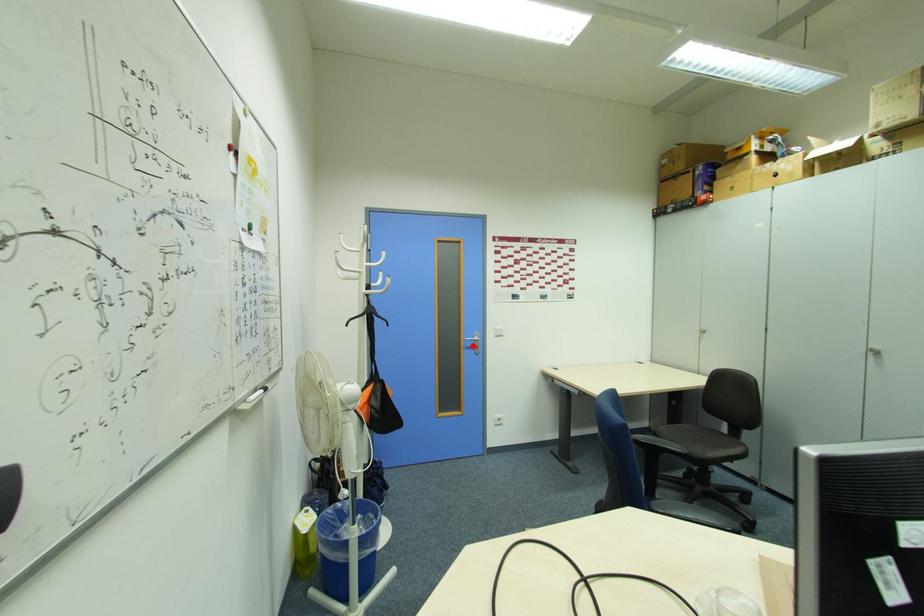
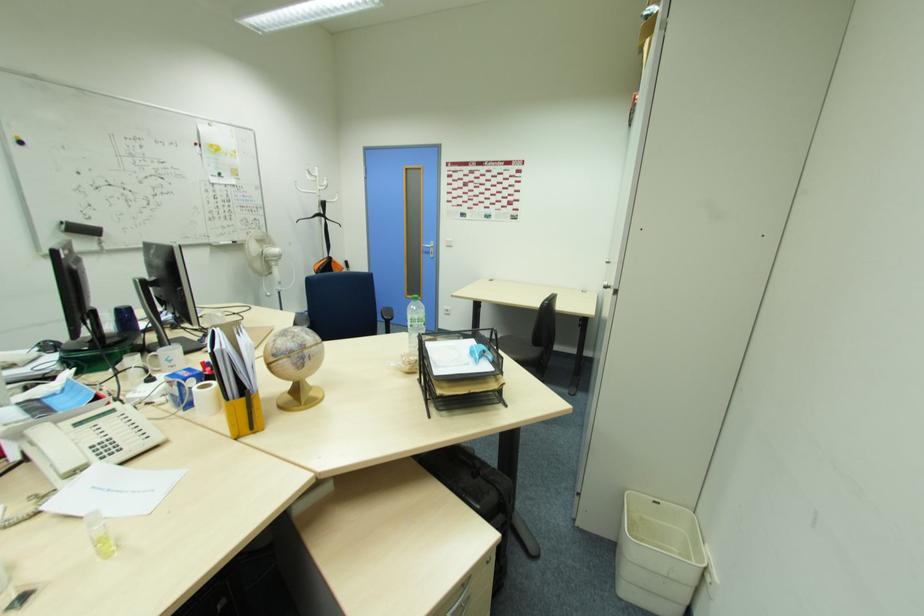
Question: I am providing you with two images of the same scene from different viewpoints. A red point is marked on the first image. Can you still see the location of the red point in image 2?

Choices:
 (A) Yes
 (B) No

Answer: (A)